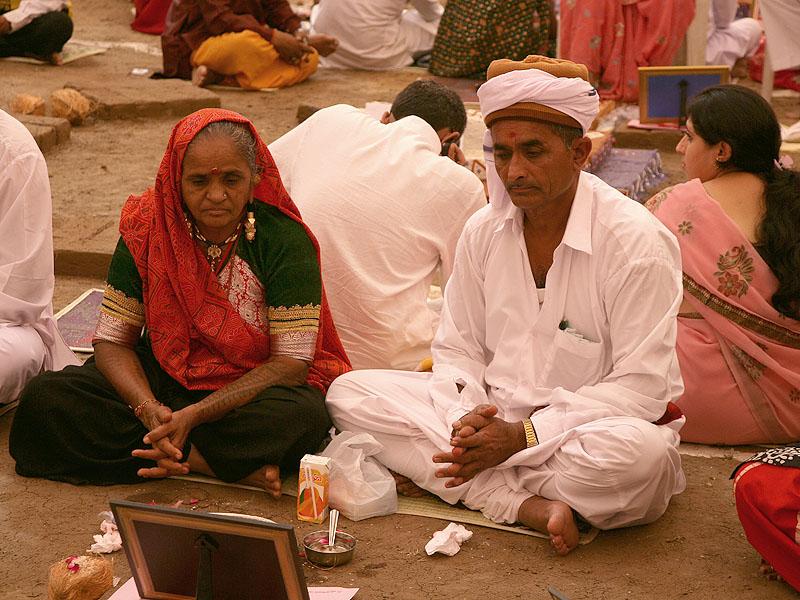
Locate an element on the screen. bottom of decorative robe is located at coordinates (466, 47), (633, 40).